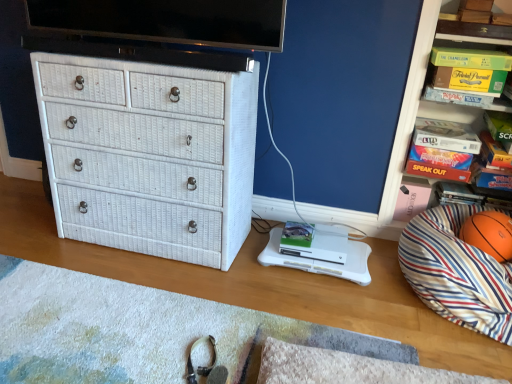
Question: Is orange matte basketball at right bigger or smaller than white textured mat at lower center?

Choices:
 (A) small
 (B) big

Answer: (B)

Question: Is orange matte basketball at right taller or shorter than white textured mat at lower center?

Choices:
 (A) tall
 (B) short

Answer: (A)

Question: Which of these objects is positioned farthest from the striped fabric bean bag at right?

Choices:
 (A) green cardboard game at upper right
 (B) white wicker chest of drawers at left
 (C) orange matte basketball at right
 (D) green cardboard box at upper right
 (E) orange rubber basketball at right

Answer: (B)

Question: Estimate the real-world distances between objects in this image. Which object is farther from the orange rubber basketball at right?

Choices:
 (A) green cardboard box at upper right
 (B) green cardboard game at upper right
 (C) white wicker chest of drawers at left
 (D) striped fabric bean bag at right
 (E) orange matte basketball at right

Answer: (C)